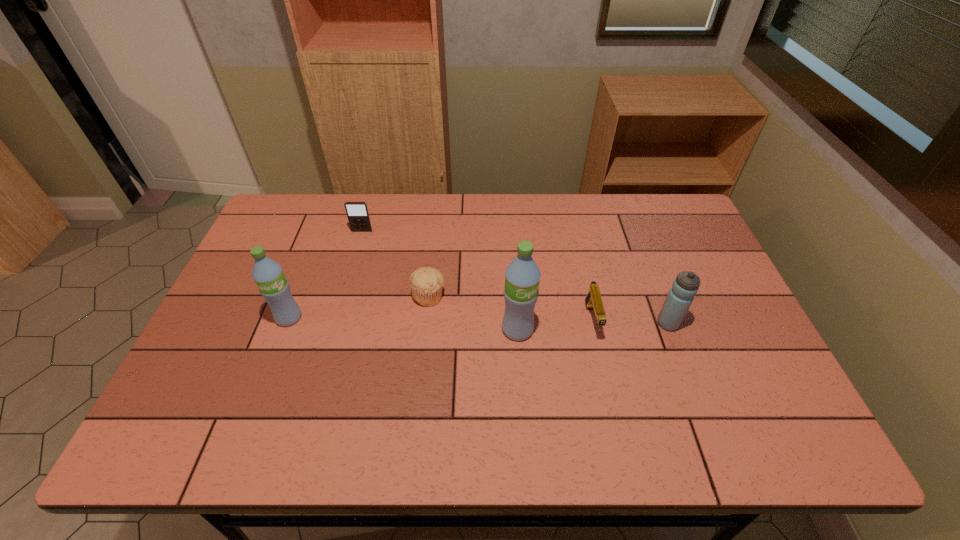
I want to click on the fifth shortest object, so pos(268,274).

Where is `the leftmost water bottle`? the leftmost water bottle is located at coordinates (268, 274).

At what (x,y) coordinates should I click in order to perform the action: click on the second water bottle from right to left. Please return your answer as a coordinate pair (x, y). The height and width of the screenshot is (540, 960). Looking at the image, I should click on (522, 276).

Where is `the third object from right to left`? the third object from right to left is located at coordinates (522, 276).

Find the location of a particular element. iPod is located at coordinates (358, 216).

Where is `the farthest object`? the farthest object is located at coordinates (358, 216).

This screenshot has width=960, height=540. I want to click on pistol, so click(593, 299).

The width and height of the screenshot is (960, 540). I want to click on muffin, so [x=426, y=283].

Find the location of `the rightmost object`. the rightmost object is located at coordinates (681, 295).

Find the location of a particular element. the rightmost water bottle is located at coordinates (681, 295).